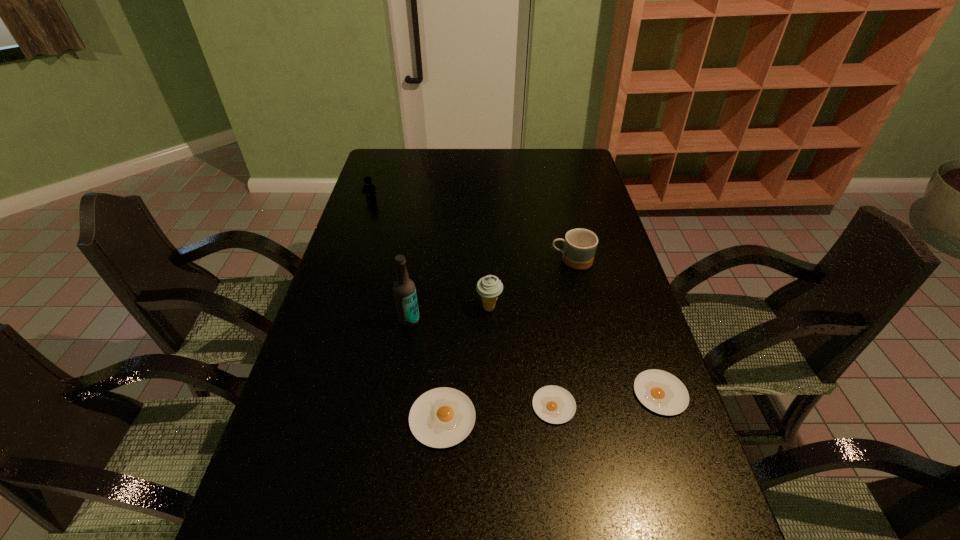
Where is `the leftmost egg yolk`? the leftmost egg yolk is located at coordinates (442, 417).

Identify the location of the third shortest object. Image resolution: width=960 pixels, height=540 pixels. (442, 417).

Locate an element on the screen. The image size is (960, 540). the shortest egg yolk is located at coordinates (553, 404).

At what (x,y) coordinates should I click in order to perform the action: click on the second egg yolk from right to left. Please return your answer as a coordinate pair (x, y). Looking at the image, I should click on (553, 404).

Locate an element on the screen. This screenshot has width=960, height=540. the second shortest egg yolk is located at coordinates tap(661, 392).

Find the location of `the rightmost egg yolk`. the rightmost egg yolk is located at coordinates (661, 392).

You are a GUI agent. You are given a task and a screenshot of the screen. Output one action in this format:
    pyautogui.click(x=<x>, y=<y>)
    Task: Click on the mug
    This screenshot has width=960, height=540.
    Given the screenshot: What is the action you would take?
    pyautogui.click(x=580, y=245)

The width and height of the screenshot is (960, 540). In order to click on Lego in this screenshot , I will do `click(369, 188)`.

Find the location of a particular element. the leftmost object is located at coordinates (369, 188).

This screenshot has width=960, height=540. I want to click on icecream, so click(489, 287).